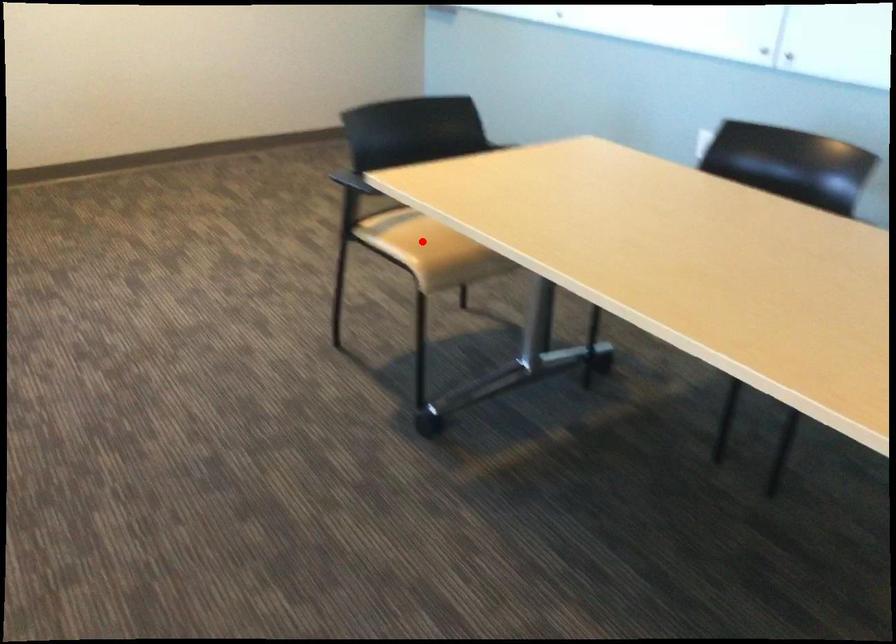
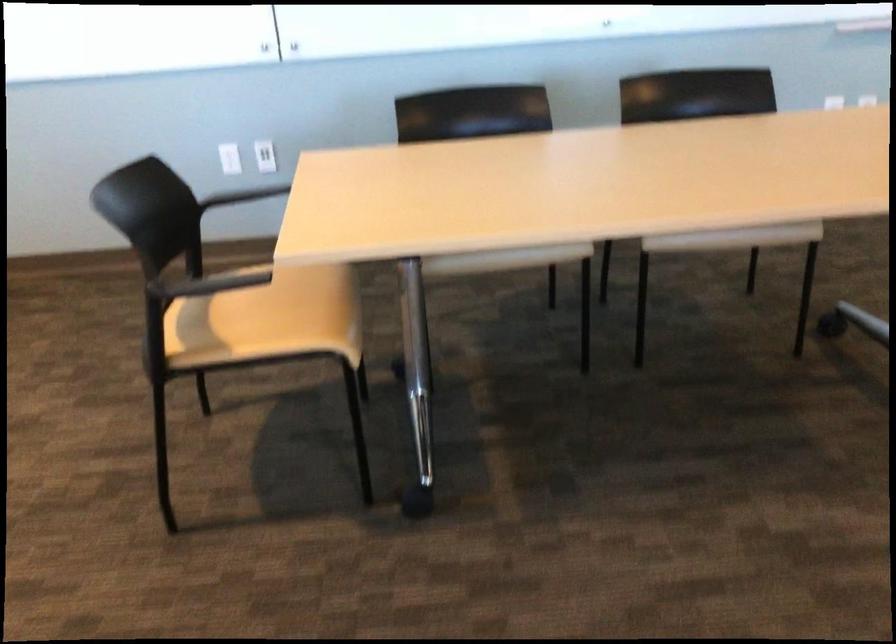
Where in the second image is the point corresponding to the highlighted location from the first image?

(274, 315)